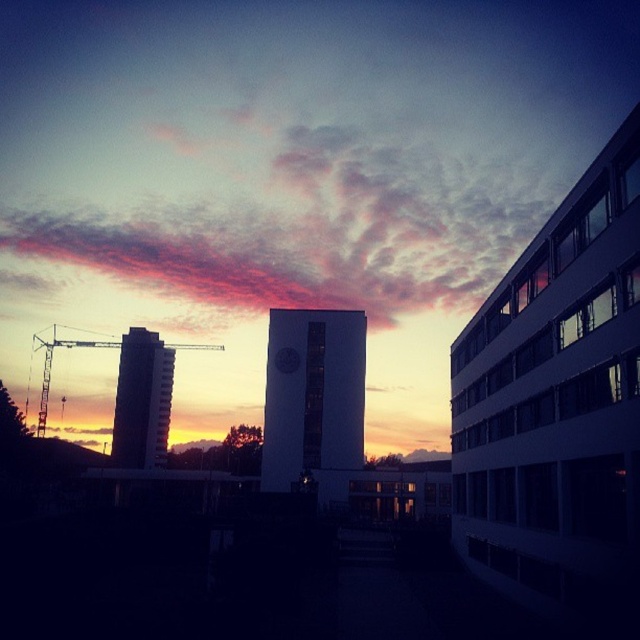
Question: Which of the following is the closest to the observer?

Choices:
 (A) white smooth tower at center
 (B) pink cotton clouds at upper center

Answer: (A)

Question: Is white smooth tower at center to the right of metallic construction crane at left from the viewer's perspective?

Choices:
 (A) yes
 (B) no

Answer: (A)

Question: Can you confirm if white smooth tower at center is wider than silhouette glass tower at left?

Choices:
 (A) yes
 (B) no

Answer: (A)

Question: From the image, what is the correct spatial relationship of white smooth tower at center in relation to silhouette glass tower at left?

Choices:
 (A) right
 (B) left

Answer: (A)

Question: Which point appears farthest from the camera in this image?

Choices:
 (A) pos(436,300)
 (B) pos(122,433)
 (C) pos(362,323)

Answer: (A)

Question: Which object is farther from the camera taking this photo?

Choices:
 (A) white smooth tower at center
 (B) pink cotton clouds at upper center
 (C) metallic construction crane at left

Answer: (B)